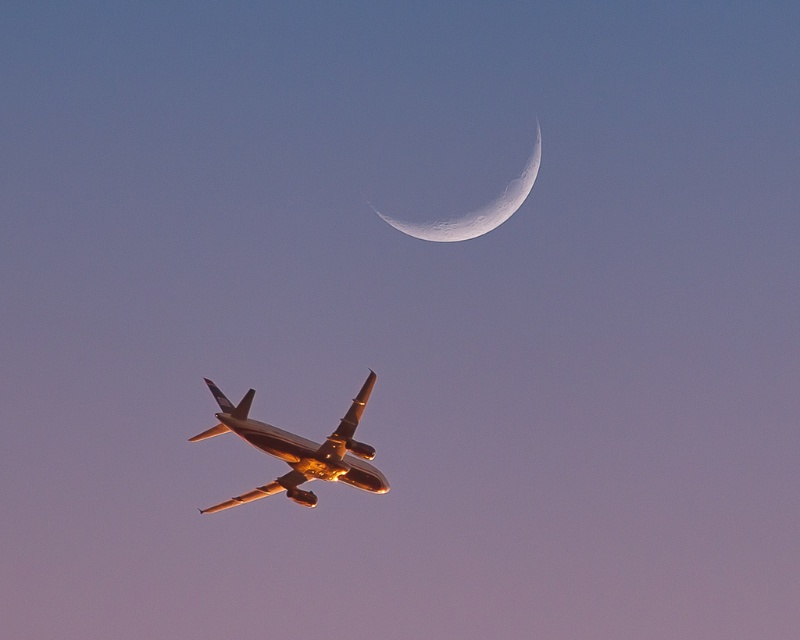
Question: Considering the relative positions of metallic gold airplane at center and smooth white crescent at upper center in the image provided, where is metallic gold airplane at center located with respect to smooth white crescent at upper center?

Choices:
 (A) below
 (B) above

Answer: (A)

Question: Is metallic gold airplane at center positioned behind smooth white crescent at upper center?

Choices:
 (A) no
 (B) yes

Answer: (A)

Question: Among these points, which one is farthest from the camera?

Choices:
 (A) (348, 445)
 (B) (460, 230)

Answer: (B)

Question: Is metallic gold airplane at center further to camera compared to smooth white crescent at upper center?

Choices:
 (A) yes
 (B) no

Answer: (B)